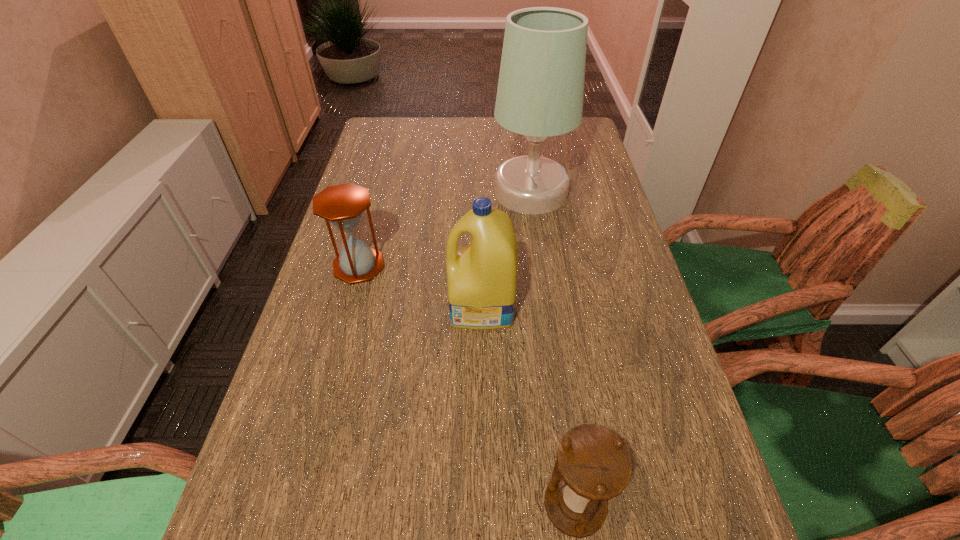
The image size is (960, 540). I want to click on object that is the second closest to the second tallest object, so click(540, 92).

Identify which object is located as the second nearest to the farther hourglass. Please provide its 2D coordinates. Your answer should be formatted as a tuple, i.e. [(x, y)], where the tuple contains the x and y coordinates of a point satisfying the conditions above.

[(540, 92)]

The image size is (960, 540). What are the coordinates of `free spot that satisfies the following two spatial constraints: 1. on the label of the detergent; 2. on the left side of the nearer hourglass` in the screenshot? It's located at (482, 505).

Locate an element on the screen. free space that satisfies the following two spatial constraints: 1. on the label of the detergent; 2. on the left side of the nearest object is located at coordinates (482, 505).

Locate an element on the screen. The height and width of the screenshot is (540, 960). vacant space that satisfies the following two spatial constraints: 1. on the base of the farthest object; 2. on the front side of the left hourglass is located at coordinates (540, 266).